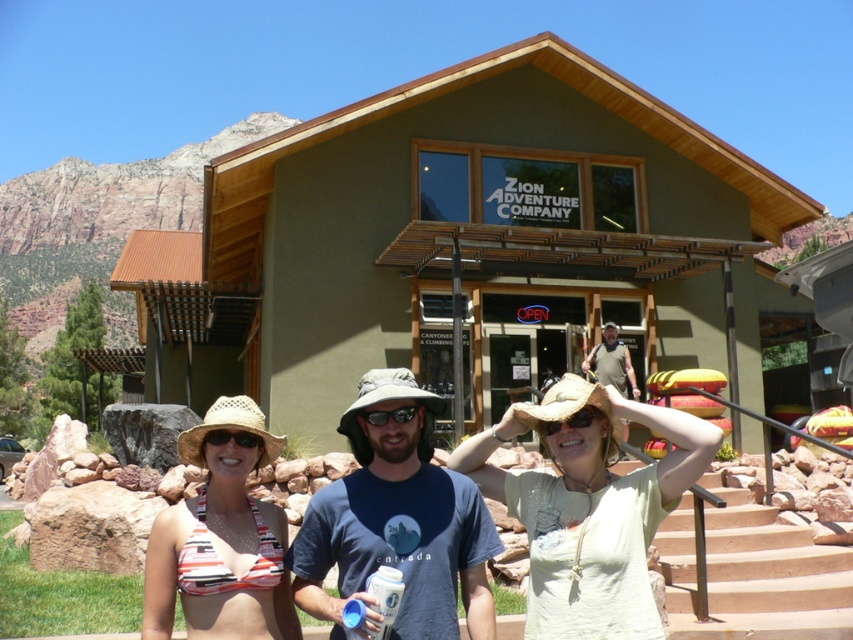
Can you confirm if brown fabric cowboy hat at center is shorter than matte green shirt at center?

No, brown fabric cowboy hat at center is not shorter than matte green shirt at center.

Describe the element at coordinates (389, 400) in the screenshot. The height and width of the screenshot is (640, 853). I see `brown fabric cowboy hat at center` at that location.

Is point (428, 448) positioned before point (598, 369)?

Yes, it is.

This screenshot has height=640, width=853. I want to click on brown fabric cowboy hat at center, so click(389, 400).

Is transparent plastic goggles at center positioned in front of black plastic goggles at center?

No.

Does transparent plastic goggles at center come behind black plastic goggles at center?

Yes.

Locate an element on the screen. transparent plastic goggles at center is located at coordinates (389, 413).

I want to click on transparent plastic goggles at center, so click(389, 413).

Who is higher up, brown fabric cowboy hat at center or matte plastic goggles at center?

matte plastic goggles at center is higher up.

Where is `brown fabric cowboy hat at center`? Image resolution: width=853 pixels, height=640 pixels. brown fabric cowboy hat at center is located at coordinates (389, 400).

Is point (393, 384) positioned before point (219, 445)?

That is True.

Identify the location of brown fabric cowboy hat at center. The image size is (853, 640). (389, 400).